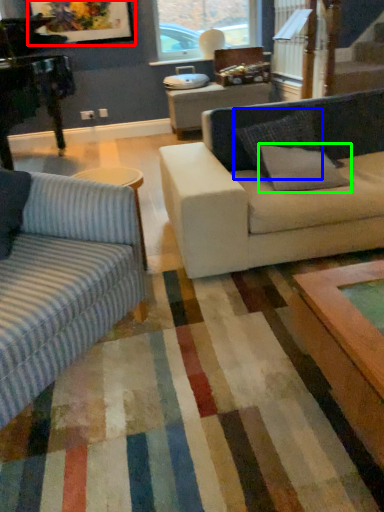
Question: Considering the real-world distances, which object is farthest from picture frame (highlighted by a red box)? pillow (highlighted by a blue box) or pillow (highlighted by a green box)?

Choices:
 (A) pillow
 (B) pillow

Answer: (B)